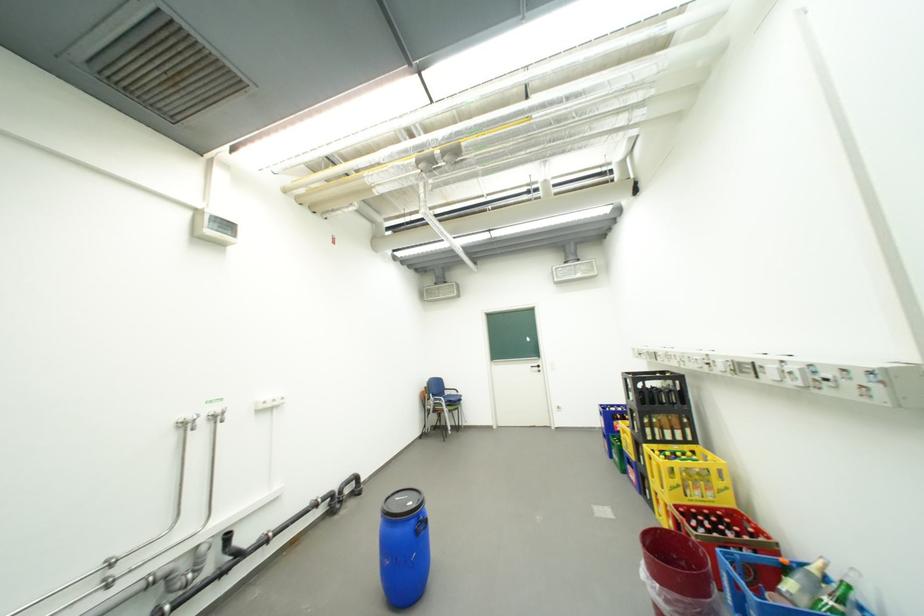
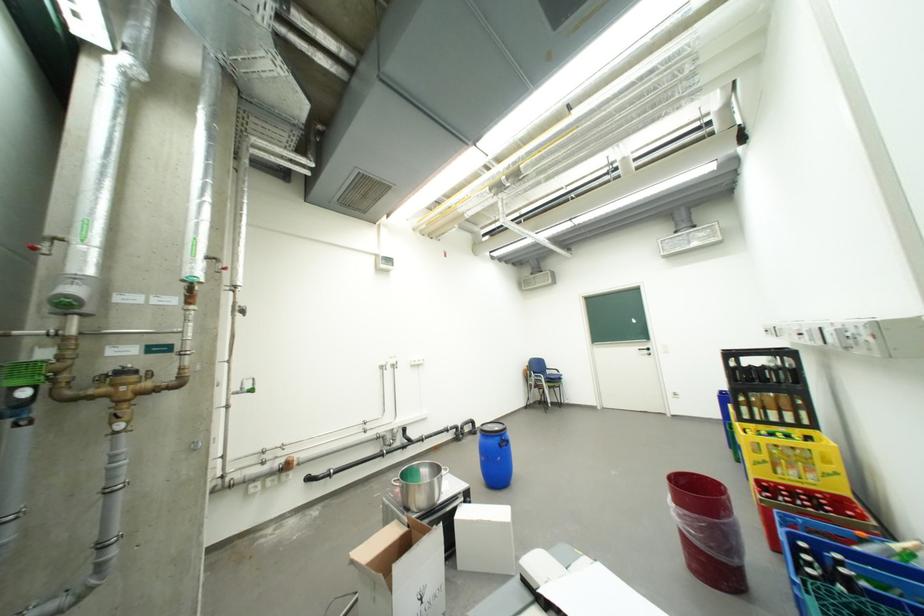
Where in the second image is the point corresponding to (x=669, y=586) from the first image?

(685, 507)